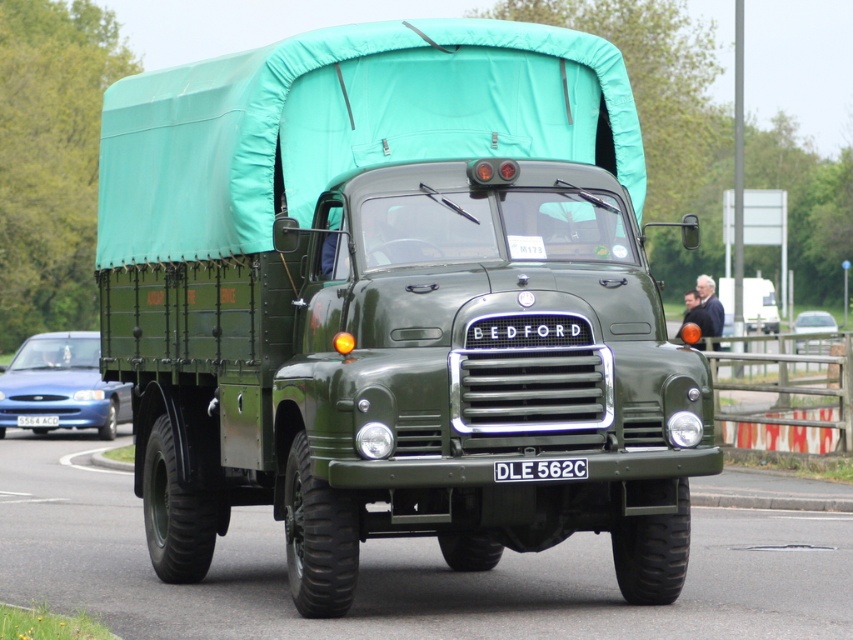
Question: Is black plastic license plate at center smaller than matte green coach at center?

Choices:
 (A) no
 (B) yes

Answer: (B)

Question: Is green rubber tire at lower center positioned at the back of matte blue sedan at left?

Choices:
 (A) no
 (B) yes

Answer: (A)

Question: Which of these objects is positioned farthest from the metallic silver car at center?

Choices:
 (A) matte green coach at center
 (B) green matte truck at center
 (C) white plastic license plate at center

Answer: (B)

Question: Is green matte truck at center above black plastic license plate at center?

Choices:
 (A) no
 (B) yes

Answer: (B)

Question: Which object is closer to the camera taking this photo?

Choices:
 (A) metallic silver car at center
 (B) matte green coach at center

Answer: (B)

Question: Which point is farther from the camera taking this photo?

Choices:
 (A) pos(51,417)
 (B) pos(718,301)
 (C) pos(811,321)

Answer: (C)